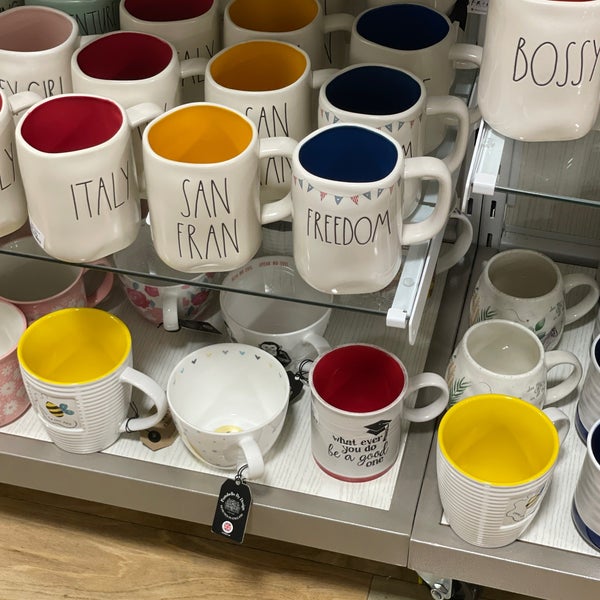
You are a GUI agent. You are given a task and a screenshot of the screen. Output one action in this format:
    pyautogui.click(x=<x>, y=<y>)
    Task: Click on the wooden floor
    
    Given the screenshot: What is the action you would take?
    pyautogui.click(x=164, y=574)